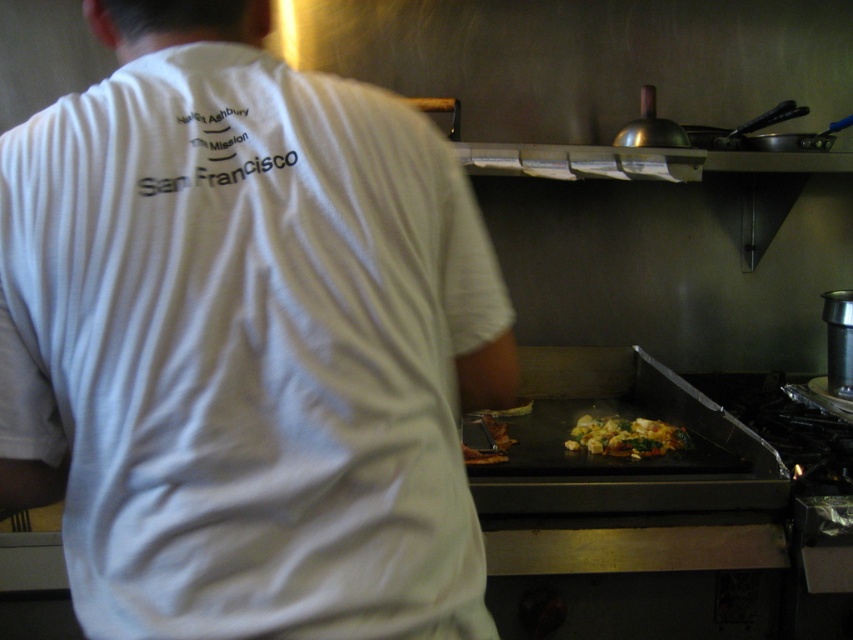
Does white fabric text at upper center come behind green leafy vegetables at center?

No.

Does white fabric text at upper center have a lesser width compared to green leafy vegetables at center?

No, white fabric text at upper center is not thinner than green leafy vegetables at center.

Measure the distance between white fabric text at upper center and camera.

white fabric text at upper center and camera are 71.41 centimeters apart from each other.

Identify the location of white fabric text at upper center. (218, 157).

Based on the photo, does multicolored glossy vegetables at center have a greater width compared to green leafy vegetables at center?

Correct, the width of multicolored glossy vegetables at center exceeds that of green leafy vegetables at center.

Does multicolored glossy vegetables at center appear under green leafy vegetables at center?

Incorrect, multicolored glossy vegetables at center is not positioned below green leafy vegetables at center.

Where is `multicolored glossy vegetables at center`? multicolored glossy vegetables at center is located at coordinates pyautogui.click(x=625, y=436).

Based on the photo, can you confirm if white cotton shirt at center is taller than green leafy vegetables at center?

Yes, white cotton shirt at center is taller than green leafy vegetables at center.

Which of these two, white cotton shirt at center or green leafy vegetables at center, stands shorter?

green leafy vegetables at center

Which is in front, point (44, 269) or point (486, 422)?

Point (44, 269) is more forward.

Identify the location of white cotton shirt at center. This screenshot has width=853, height=640. (247, 346).